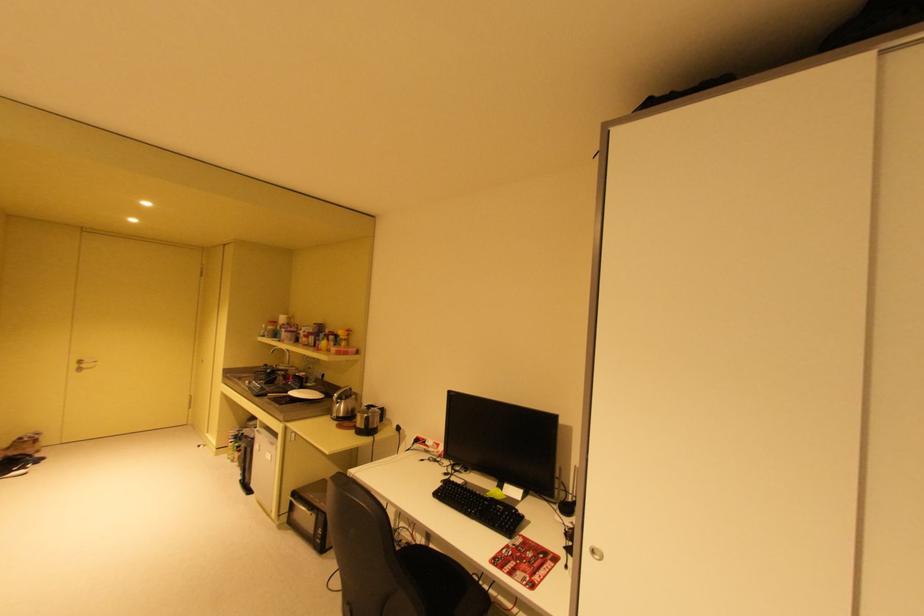
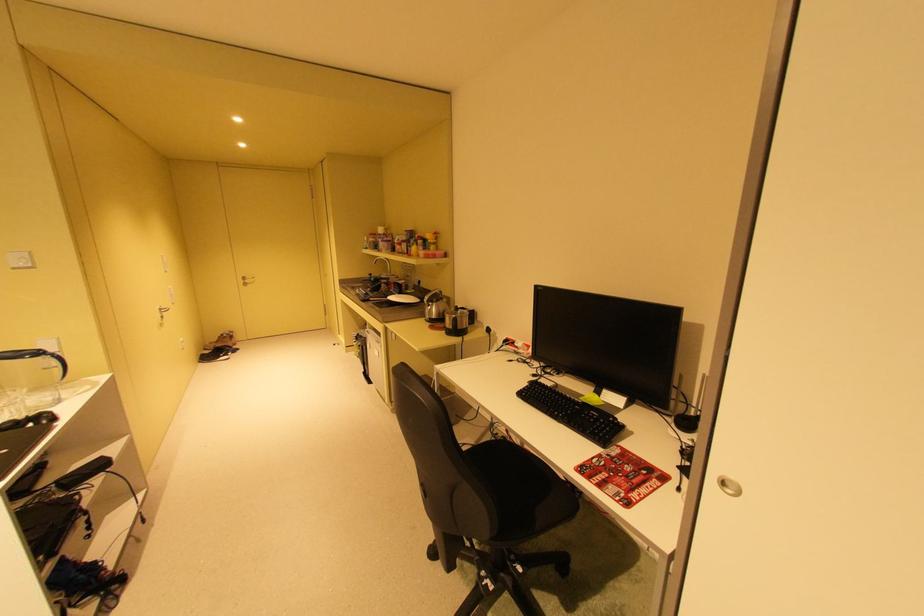
Which direction would the cameraman need to move to produce the second image?

The movement direction of the cameraman is right, forward.